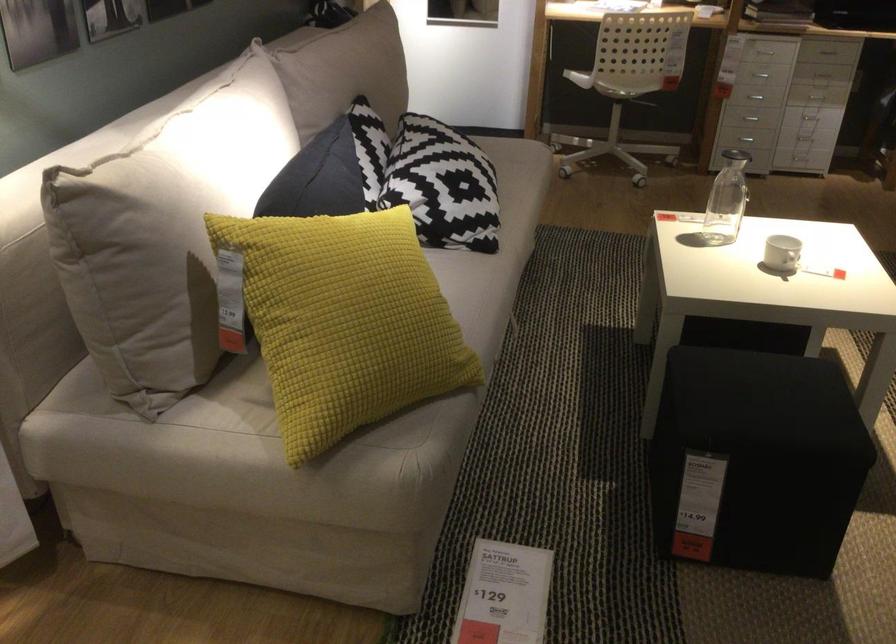
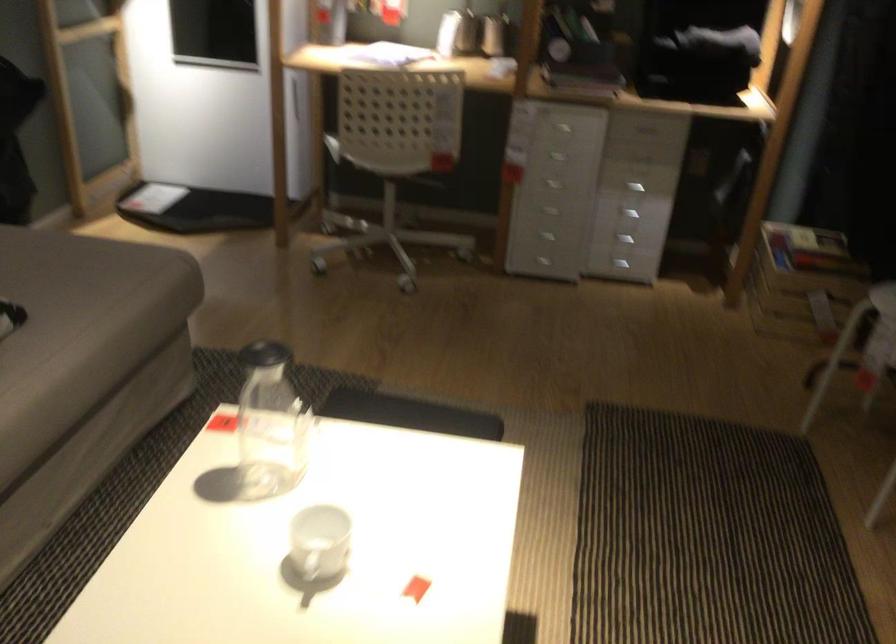
Where in the second image is the point corresponding to point 520,182 from the first image?

(82, 324)